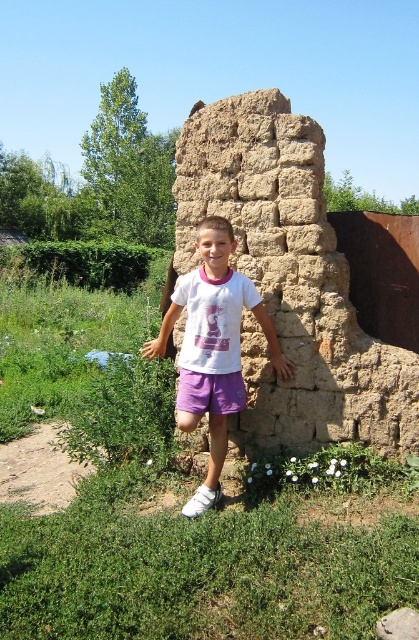
You are a photographer trying to capture the brown mudbrick wall at center and the white cotton shirt at center in the same frame. Which object should you focus on first to ensure both are in focus?

You should focus on the brown mudbrick wall at center first because it is closer to the viewer than the white cotton shirt at center, so focusing on the closer object will help both be in focus.

The scene shows a boy standing in front of a rustic stone structure. Based on the objects present, can you determine which object is positioned to the right of the other between the brown mudbrick wall at center and the white cotton shirt at center?

The brown mudbrick wall at center is positioned to the right of the white cotton shirt at center.

Looking at this image, you are a drone operator trying to land a drone on the green grass at center. What are the coordinates where you should aim the drone?

The coordinates for the green grass at center are at point (173, 509).